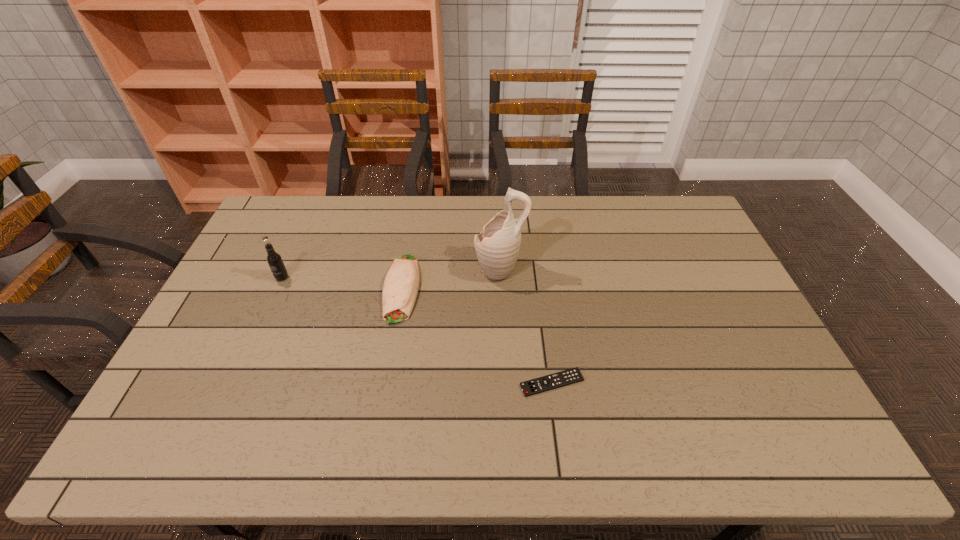
Identify the location of the tallest object. This screenshot has height=540, width=960. (497, 247).

You are a GUI agent. You are given a task and a screenshot of the screen. Output one action in this format:
    pyautogui.click(x=<x>, y=<y>)
    Task: Click on the leftmost object
    This screenshot has height=540, width=960.
    Given the screenshot: What is the action you would take?
    pyautogui.click(x=275, y=262)

Find the location of `root beer`. root beer is located at coordinates (275, 262).

This screenshot has height=540, width=960. Find the location of `the third tallest object`. the third tallest object is located at coordinates (401, 284).

This screenshot has width=960, height=540. Identify the location of burrito. (401, 284).

What are the coordinates of `the shortest object` in the screenshot? It's located at (567, 377).

This screenshot has height=540, width=960. In order to click on the nearest object in this screenshot , I will do `click(567, 377)`.

Find the location of a particular element. The height and width of the screenshot is (540, 960). vacant space situated 0.210m at the spout of the pitcher is located at coordinates (410, 270).

Where is `blank space located at the spout of the pitcher`? blank space located at the spout of the pitcher is located at coordinates (410, 270).

What are the coordinates of `free space located at the spout of the pitcher` in the screenshot? It's located at (389, 270).